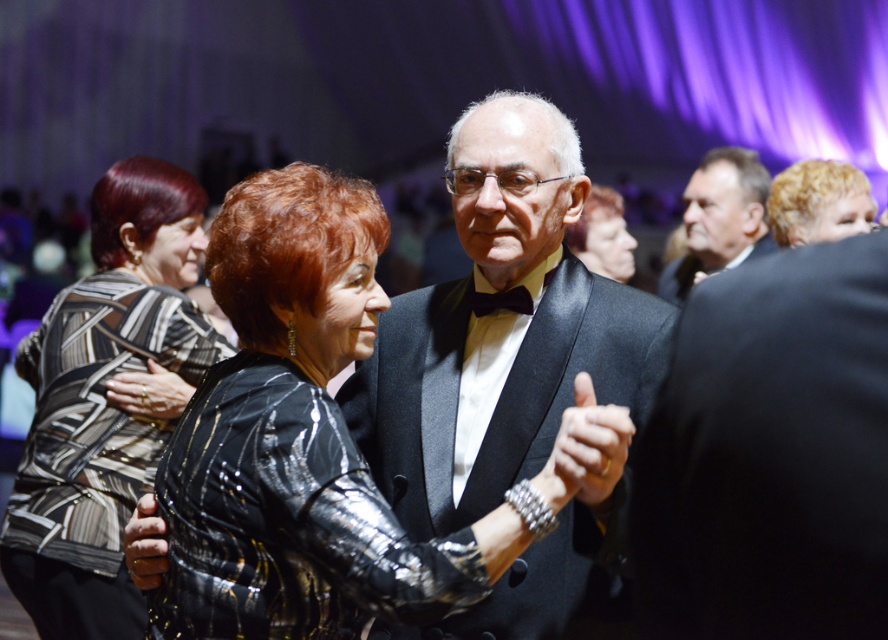
Does point (546, 465) come in front of point (755, 250)?

Yes, point (546, 465) is in front of point (755, 250).

Is metallic bracelet at center positioned behind black satin tuxedo at upper center?

No, it is not.

At what (x,y) coordinates should I click in order to perform the action: click on metallic bracelet at center. Please return your answer as a coordinate pair (x, y). Looking at the image, I should click on (585, 449).

At what (x,y) coordinates should I click in order to perform the action: click on metallic bracelet at center. Please return your answer as a coordinate pair (x, y). Looking at the image, I should click on (585, 449).

Can you confirm if satin black suit at center is bigger than black satin tuxedo at upper center?

Correct, satin black suit at center is larger in size than black satin tuxedo at upper center.

What do you see at coordinates (498, 330) in the screenshot? This screenshot has height=640, width=888. I see `satin black suit at center` at bounding box center [498, 330].

I want to click on satin black suit at center, so click(498, 330).

Is point (657, 296) positioned after point (484, 305)?

Yes, point (657, 296) is farther from viewer.

Can you confirm if black satin tuxedo at upper center is bigger than black satin bow tie at center?

Correct, black satin tuxedo at upper center is larger in size than black satin bow tie at center.

Does point (691, 259) come farther from viewer compared to point (529, 314)?

Yes, it is.

You are a GUI agent. You are given a task and a screenshot of the screen. Output one action in this format:
    pyautogui.click(x=<x>, y=<y>)
    Task: Click on the black satin tuxedo at upper center
    
    Given the screenshot: What is the action you would take?
    pyautogui.click(x=679, y=278)